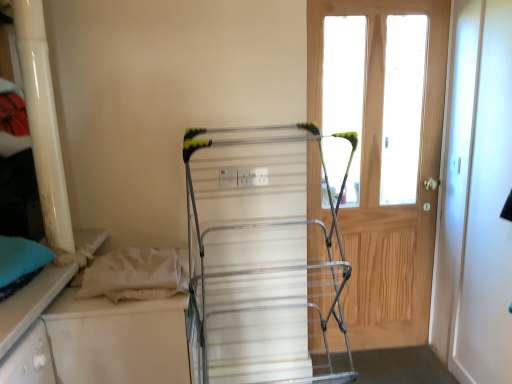
Question: Does silver metallic drying rack at center have a larger size compared to light brown wooden door at right?

Choices:
 (A) yes
 (B) no

Answer: (A)

Question: Is silver metallic drying rack at center positioned behind light brown wooden door at right?

Choices:
 (A) no
 (B) yes

Answer: (A)

Question: Is silver metallic drying rack at center in front of light brown wooden door at right?

Choices:
 (A) yes
 (B) no

Answer: (A)

Question: Is silver metallic drying rack at center outside light brown wooden door at right?

Choices:
 (A) no
 (B) yes

Answer: (B)

Question: From a real-world perspective, is silver metallic drying rack at center on top of light brown wooden door at right?

Choices:
 (A) yes
 (B) no

Answer: (B)

Question: From the image's perspective, is silver metallic drying rack at center below light brown wooden door at right?

Choices:
 (A) yes
 (B) no

Answer: (A)

Question: Is light brown wooden door at right behind silver metallic drying rack at center?

Choices:
 (A) no
 (B) yes

Answer: (B)

Question: Does light brown wooden door at right have a lesser height compared to silver metallic drying rack at center?

Choices:
 (A) no
 (B) yes

Answer: (A)

Question: Is light brown wooden door at right wider than silver metallic drying rack at center?

Choices:
 (A) yes
 (B) no

Answer: (B)

Question: Does light brown wooden door at right appear on the left side of silver metallic drying rack at center?

Choices:
 (A) no
 (B) yes

Answer: (A)

Question: Does light brown wooden door at right have a smaller size compared to silver metallic drying rack at center?

Choices:
 (A) yes
 (B) no

Answer: (A)

Question: Is light brown wooden door at right aimed at silver metallic drying rack at center?

Choices:
 (A) no
 (B) yes

Answer: (A)

Question: Looking at their shapes, would you say light brown wooden door at right is wider or thinner than silver metallic drying rack at center?

Choices:
 (A) thin
 (B) wide

Answer: (A)